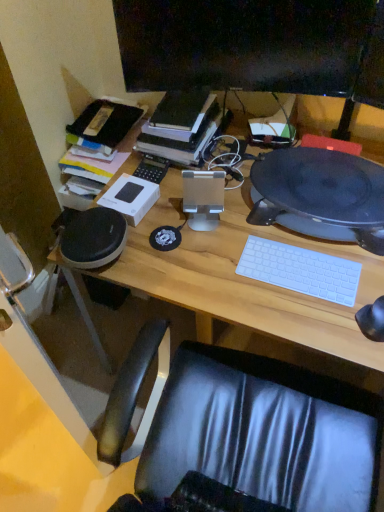
This screenshot has height=512, width=384. In order to click on vacant space situated on the left part of white matte keyboard at center in this screenshot , I will do `click(221, 272)`.